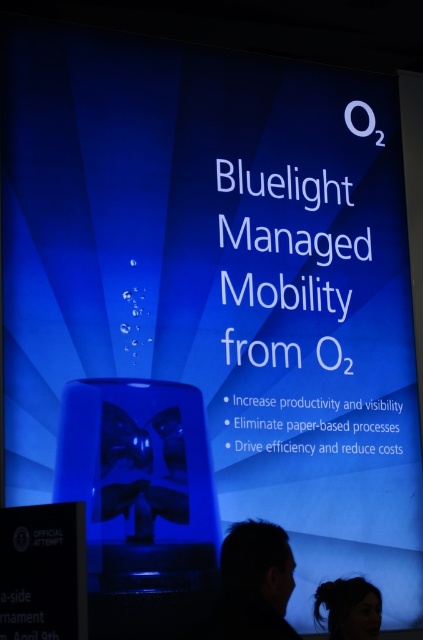
You are a photographer adjusting lighting for a photo shoot. You notice two strands of hair in the frame, the black matte hair at lower left and the dark brown hair at lower center. Which hair strand is wider?

The black matte hair at lower left is wider than the dark brown hair at lower center.

Looking at this image, you are a photographer setting up for a presentation. You notice two strands of hair in the foreground of your shot, the black matte hair at lower left and the dark brown hair at lower center. Which strand of hair is taller in the image?

The black matte hair at lower left is taller than the dark brown hair at lower center according to the description.

You are standing in front of the presentation slide and notice two points marked on the cylindrical object in the foreground. Which point, point (269, 618) or point (332, 620), is closer to your eyes?

Point (269, 618) is closer to the camera than point (332, 620).